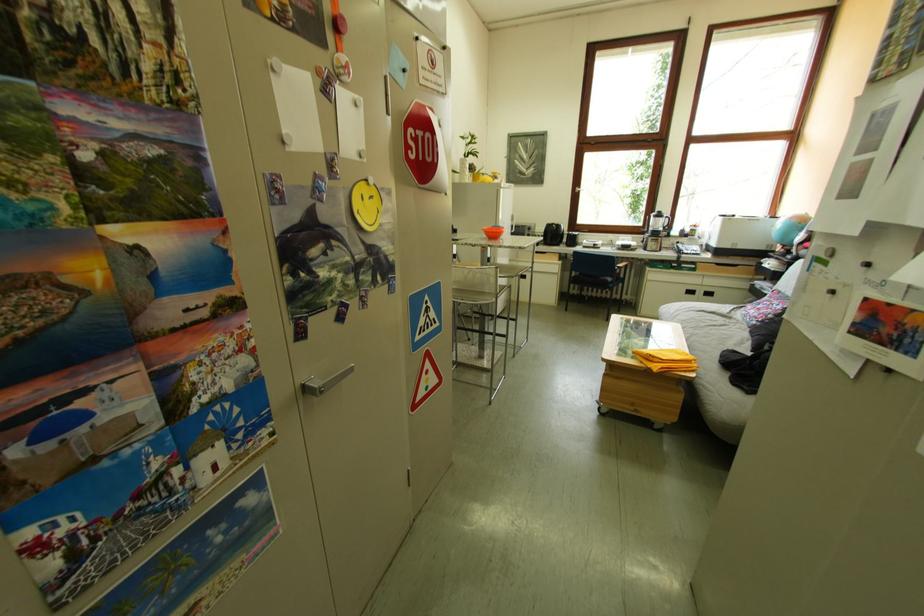
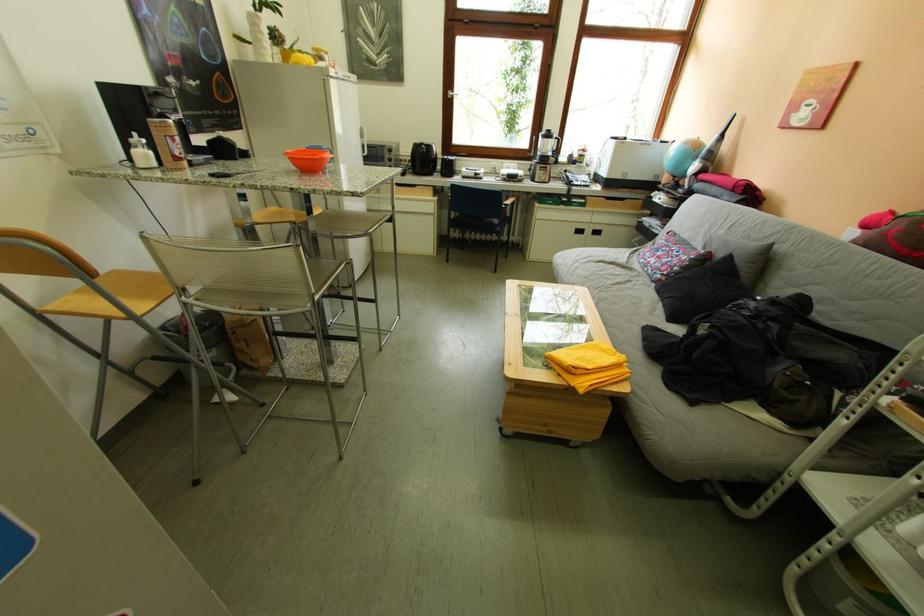
Question: I am providing you with two images of the same scene from different viewpoints. Please identify which objects are invisible in image2.

Choices:
 (A) drawer handle
 (B) vacuum cleaner handle
 (C) black pillow
 (D) none of these

Answer: (D)